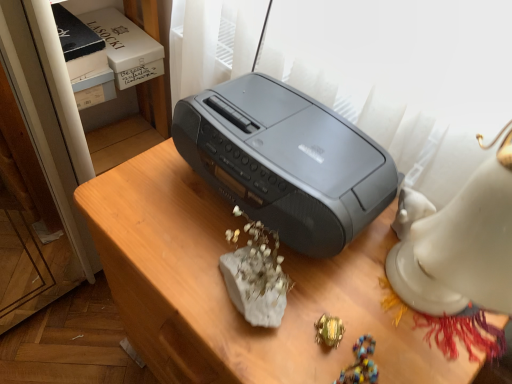
Question: Does satin gray radio at center turn towards green metallic ring at lower center?

Choices:
 (A) no
 (B) yes

Answer: (A)

Question: Considering the relative sizes of satin gray radio at center and green metallic ring at lower center in the image provided, is satin gray radio at center taller than green metallic ring at lower center?

Choices:
 (A) no
 (B) yes

Answer: (B)

Question: From the image's perspective, is satin gray radio at center located beneath green metallic ring at lower center?

Choices:
 (A) yes
 (B) no

Answer: (A)

Question: Considering the relative sizes of satin gray radio at center and green metallic ring at lower center in the image provided, is satin gray radio at center bigger than green metallic ring at lower center?

Choices:
 (A) yes
 (B) no

Answer: (A)

Question: From a real-world perspective, is satin gray radio at center below green metallic ring at lower center?

Choices:
 (A) yes
 (B) no

Answer: (A)

Question: From the image's perspective, is green metallic ring at lower center above or below slate gray plastic printer at center?

Choices:
 (A) above
 (B) below

Answer: (B)

Question: Do you think green metallic ring at lower center is within slate gray plastic printer at center, or outside of it?

Choices:
 (A) inside
 (B) outside

Answer: (B)

Question: From a real-world perspective, is green metallic ring at lower center positioned above or below slate gray plastic printer at center?

Choices:
 (A) below
 (B) above

Answer: (A)

Question: Looking at their shapes, would you say green metallic ring at lower center is wider or thinner than slate gray plastic printer at center?

Choices:
 (A) thin
 (B) wide

Answer: (A)

Question: Is satin gray radio at center bigger or smaller than green metallic ring at lower center?

Choices:
 (A) big
 (B) small

Answer: (A)

Question: From the image's perspective, is satin gray radio at center above or below green metallic ring at lower center?

Choices:
 (A) above
 (B) below

Answer: (B)

Question: Is satin gray radio at center spatially inside green metallic ring at lower center, or outside of it?

Choices:
 (A) inside
 (B) outside

Answer: (B)

Question: Considering the positions of point (224, 311) and point (320, 337), is point (224, 311) closer or farther from the camera than point (320, 337)?

Choices:
 (A) farther
 (B) closer

Answer: (A)

Question: Which is correct: slate gray plastic printer at center is inside green metallic ring at lower center, or outside of it?

Choices:
 (A) outside
 (B) inside

Answer: (A)

Question: Is point (321, 208) positioned closer to the camera than point (320, 327)?

Choices:
 (A) farther
 (B) closer

Answer: (B)